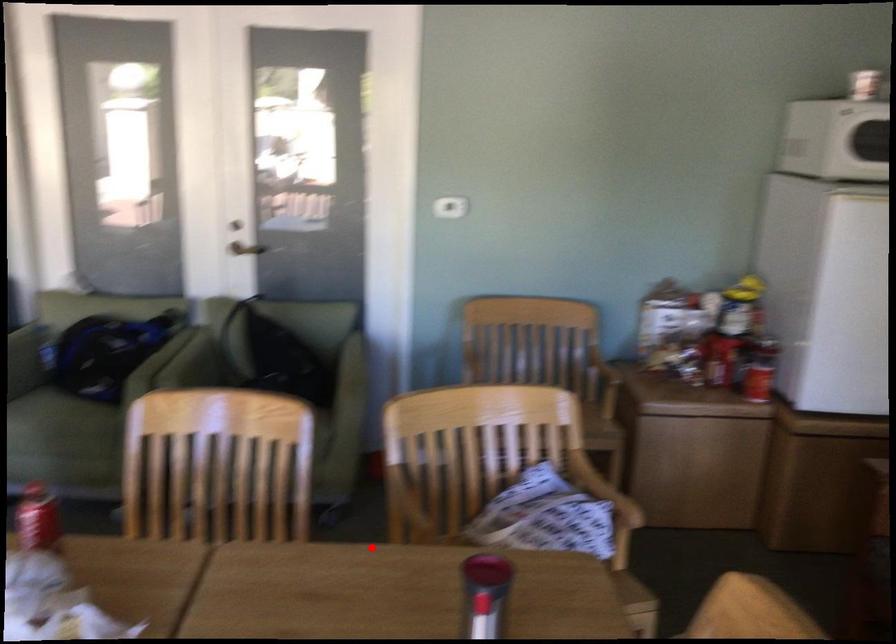
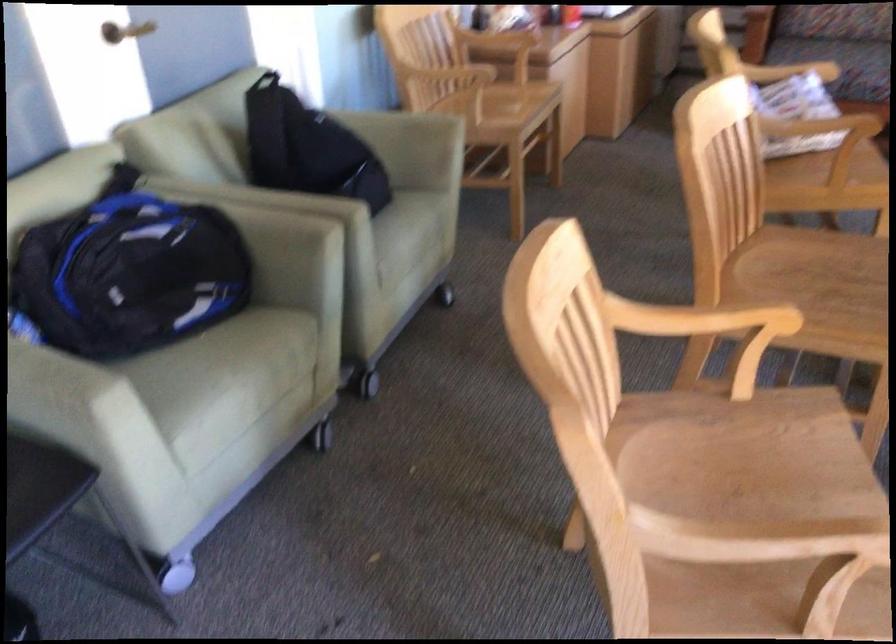
Question: I am providing you with two images of the same scene from different viewpoints. A red point is shown in image1. For the corresponding object point in image2, is it positioned nearer or farther from the camera?

Choices:
 (A) Nearer
 (B) Farther

Answer: (B)